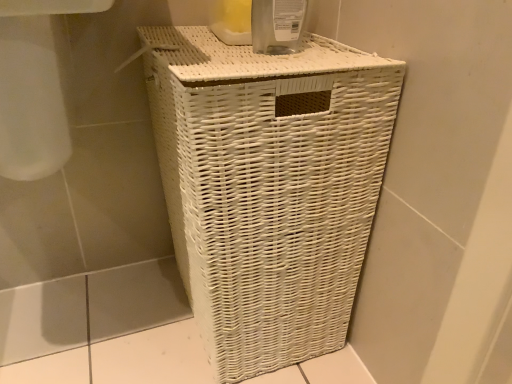
Question: Should I look upward or downward to see transparent plastic bottle at upper center?

Choices:
 (A) up
 (B) down

Answer: (A)

Question: Is transparent plastic bottle at upper center taller than white wicker basket at center?

Choices:
 (A) yes
 (B) no

Answer: (B)

Question: Is transparent plastic bottle at upper center next to white wicker basket at center?

Choices:
 (A) yes
 (B) no

Answer: (B)

Question: Considering the relative positions of transparent plastic bottle at upper center and white wicker basket at center in the image provided, is transparent plastic bottle at upper center to the left of white wicker basket at center from the viewer's perspective?

Choices:
 (A) no
 (B) yes

Answer: (A)

Question: Does transparent plastic bottle at upper center have a lesser height compared to white wicker basket at center?

Choices:
 (A) yes
 (B) no

Answer: (A)

Question: Is transparent plastic bottle at upper center not within white wicker basket at center?

Choices:
 (A) yes
 (B) no

Answer: (A)

Question: Considering the relative sizes of transparent plastic bottle at upper center and white wicker basket at center in the image provided, is transparent plastic bottle at upper center wider than white wicker basket at center?

Choices:
 (A) no
 (B) yes

Answer: (A)

Question: From the image's perspective, is white wicker basket at center below transparent plastic bottle at upper center?

Choices:
 (A) yes
 (B) no

Answer: (A)

Question: From a real-world perspective, is white wicker basket at center positioned under transparent plastic bottle at upper center based on gravity?

Choices:
 (A) no
 (B) yes

Answer: (B)

Question: Is white wicker basket at center wider than transparent plastic bottle at upper center?

Choices:
 (A) yes
 (B) no

Answer: (A)

Question: Does white wicker basket at center have a greater height compared to transparent plastic bottle at upper center?

Choices:
 (A) no
 (B) yes

Answer: (B)

Question: From the image's perspective, is white wicker basket at center on top of transparent plastic bottle at upper center?

Choices:
 (A) yes
 (B) no

Answer: (B)

Question: Is white wicker basket at center beside transparent plastic bottle at upper center?

Choices:
 (A) no
 (B) yes

Answer: (A)

Question: Does point (315, 76) appear closer or farther from the camera than point (291, 29)?

Choices:
 (A) farther
 (B) closer

Answer: (B)